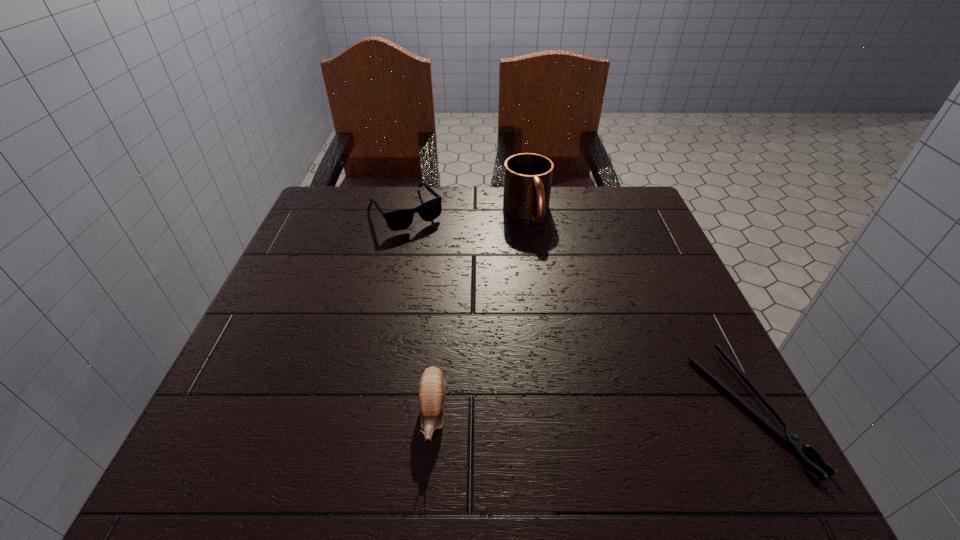
The image size is (960, 540). In order to click on free spot on the desktop that is between the second tallest object and the shortest object and is positioned on the front-facing side of the third tallest object in this screenshot , I will do `click(575, 411)`.

At what (x,y) coordinates should I click in order to perform the action: click on free space on the desktop that is between the third shortest object and the shortest object and is positioned on the side of the third object from left to right with the handle. Please return your answer as a coordinate pair (x, y). The height and width of the screenshot is (540, 960). Looking at the image, I should click on (627, 411).